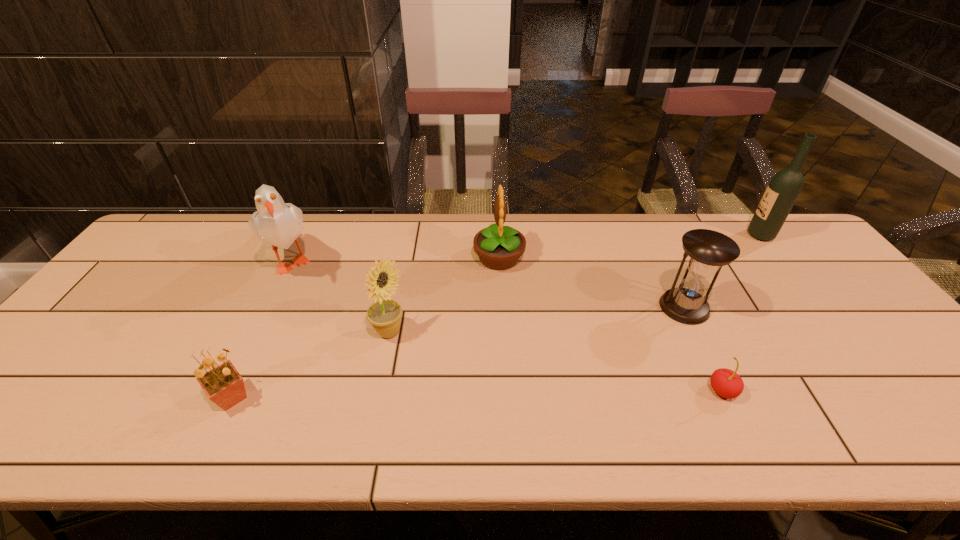
At what (x,y) coordinates should I click in order to perform the action: click on free spot located on the left of the shortest object. Please return your answer as a coordinate pair (x, y). Looking at the image, I should click on (636, 391).

Locate an element on the screen. The height and width of the screenshot is (540, 960). wine bottle present at the far edge is located at coordinates (784, 188).

I want to click on gull located at the far edge, so click(x=279, y=224).

Where is `sunflower that is at the far edge`? The image size is (960, 540). sunflower that is at the far edge is located at coordinates (498, 247).

At what (x,y) coordinates should I click in order to perform the action: click on object at the near edge. Please return your answer as a coordinate pair (x, y). Image resolution: width=960 pixels, height=540 pixels. Looking at the image, I should click on (223, 385).

Identify the location of object located in the right edge section of the desktop. The width and height of the screenshot is (960, 540). (784, 188).

At what (x,y) coordinates should I click in order to perform the action: click on object positioned at the far right corner. Please return your answer as a coordinate pair (x, y). The width and height of the screenshot is (960, 540). Looking at the image, I should click on (784, 188).

In the image, there is a desktop. Where is `free region at the far edge`? free region at the far edge is located at coordinates (416, 231).

Image resolution: width=960 pixels, height=540 pixels. What are the coordinates of `vacant region at the right edge` in the screenshot? It's located at (814, 303).

Locate an element on the screen. free space at the far left corner is located at coordinates (204, 234).